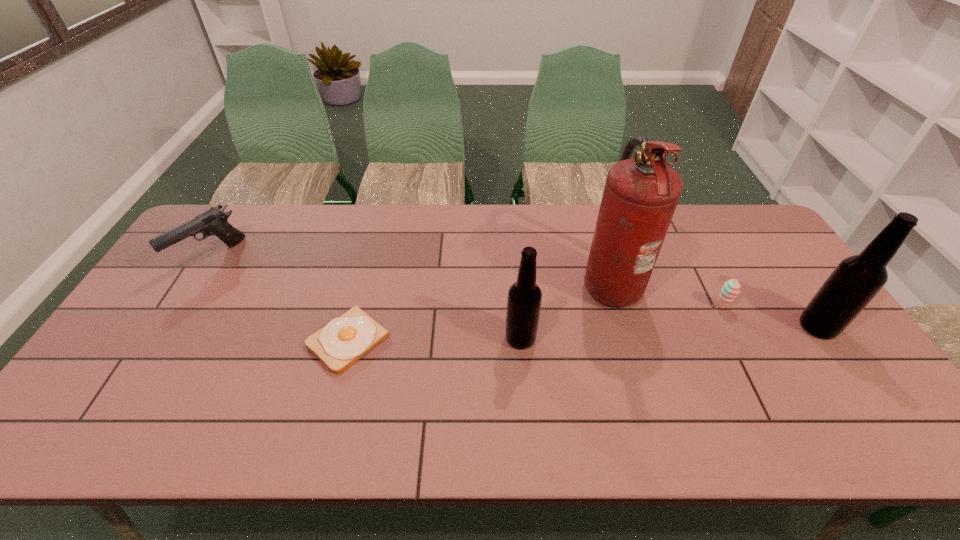
The height and width of the screenshot is (540, 960). Find the location of `the fifth object from right to left`. the fifth object from right to left is located at coordinates (344, 340).

Find the location of a particular element. the shortest object is located at coordinates (344, 340).

Where is `vacant space located on the left of the fourth shortest object`? Image resolution: width=960 pixels, height=540 pixels. vacant space located on the left of the fourth shortest object is located at coordinates (444, 339).

Where is `vacant space located 0.180m on the front of the second tallest object`? The image size is (960, 540). vacant space located 0.180m on the front of the second tallest object is located at coordinates (870, 404).

You are a GUI agent. You are given a task and a screenshot of the screen. Output one action in this format:
    pyautogui.click(x=<x>, y=<y>)
    Task: Click on the vacant space located at the muzzle of the leftmost object
    
    Given the screenshot: What is the action you would take?
    [162, 333]

The height and width of the screenshot is (540, 960). In order to click on free spot located 0.330m on the left of the sherbert in this screenshot , I will do `click(598, 306)`.

Where is `free space located 0.320m at the front of the fire extinguisher where the nozzle is aimed`? This screenshot has height=540, width=960. free space located 0.320m at the front of the fire extinguisher where the nozzle is aimed is located at coordinates (474, 282).

You are a GUI agent. You are given a task and a screenshot of the screen. Output one action in this format:
    pyautogui.click(x=<x>, y=<y>)
    Task: Click on the vacant space located at the front of the fire extinguisher where the nozzle is aimed
    
    Given the screenshot: What is the action you would take?
    pyautogui.click(x=531, y=282)

Where is `free space located at the front of the fire extinguisher where the nozzle is aimed`? This screenshot has width=960, height=540. free space located at the front of the fire extinguisher where the nozzle is aimed is located at coordinates (484, 282).

This screenshot has width=960, height=540. In order to click on vacant space situated on the left of the second object from left to right in this screenshot , I will do `click(157, 340)`.